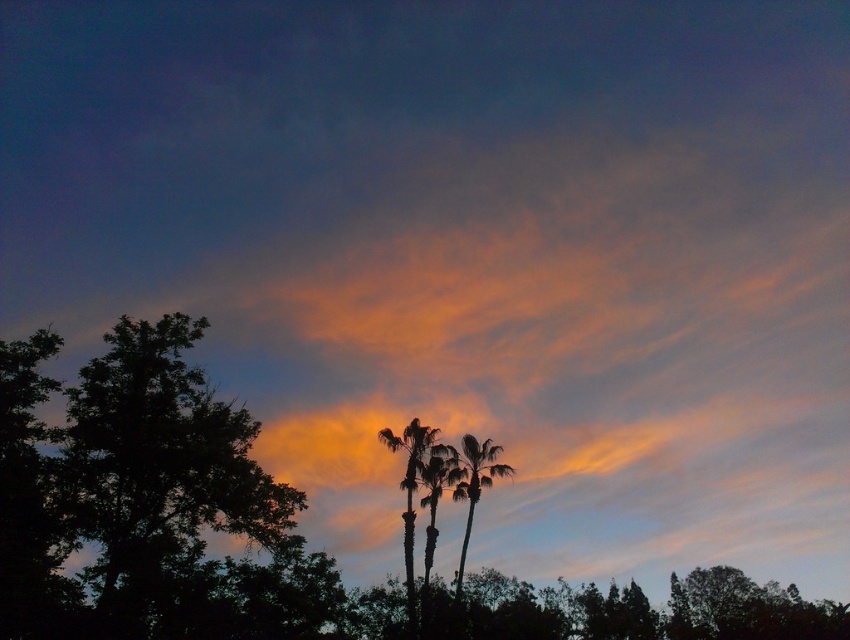
Can you confirm if silhouette palm trees at center is thinner than green leafy palm tree at center?

Correct, silhouette palm trees at center's width is less than green leafy palm tree at center's.

Does silhouette palm trees at center appear on the left side of green leafy palm tree at center?

Indeed, silhouette palm trees at center is positioned on the left side of green leafy palm tree at center.

Identify the location of silhouette palm trees at center. (411, 493).

Based on the photo, is dark green leafy tree at left positioned in front of green leafy palm tree at center?

Yes, dark green leafy tree at left is in front of green leafy palm tree at center.

Which is in front, point (148, 538) or point (471, 465)?

Point (148, 538)

Find the location of a particular element. This screenshot has height=640, width=850. dark green leafy tree at left is located at coordinates (157, 467).

Who is shorter, green leafy palm tree at center or silky green palm tree at center?

Standing shorter between the two is silky green palm tree at center.

Which of these two, green leafy palm tree at center or silky green palm tree at center, stands taller?

green leafy palm tree at center is taller.

Who is more forward, (480, 492) or (431, 506)?

Point (431, 506) is in front.

This screenshot has width=850, height=640. I want to click on green leafy palm tree at center, so click(x=473, y=484).